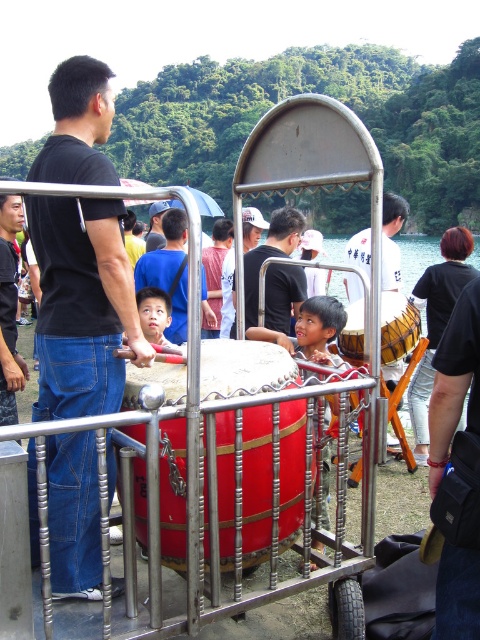
In the scene shown: You are an artist trying to paint the scene. You notice the brushed metal water at upper left and the matte white shirt at center. Which object should you focus on first if you want to paint smaller details first?

The brushed metal water at upper left has a smaller size compared to the matte white shirt at center, so you should focus on painting the brushed metal water at upper left first to capture its smaller details before moving to the larger matte white shirt at center.

You are standing in the scene and want to move from the brushed metal water at upper left to the matte white shirt at center. Which direction should you move?

To move from the brushed metal water at upper left to the matte white shirt at center, you should move to the right since the matte white shirt at center is to the right of the brushed metal water at upper left.

You are a photographer planning to take a group photo of the people in the scene. You notice the black matte shirt at upper left and the matte white shirt at center. Which person should stand closer to the front to ensure both are visible in the photo?

The black matte shirt at upper left should stand closer to the front because it is shorter than the matte white shirt at center, allowing both to be visible in the photo.